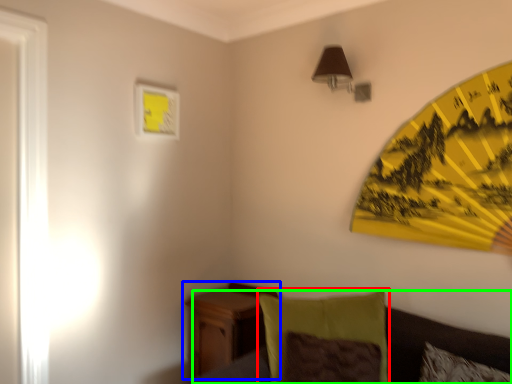
Question: Which is farther away from pillow (highlighted by a red box)? nightstand (highlighted by a blue box) or couch (highlighted by a green box)?

Choices:
 (A) nightstand
 (B) couch

Answer: (A)